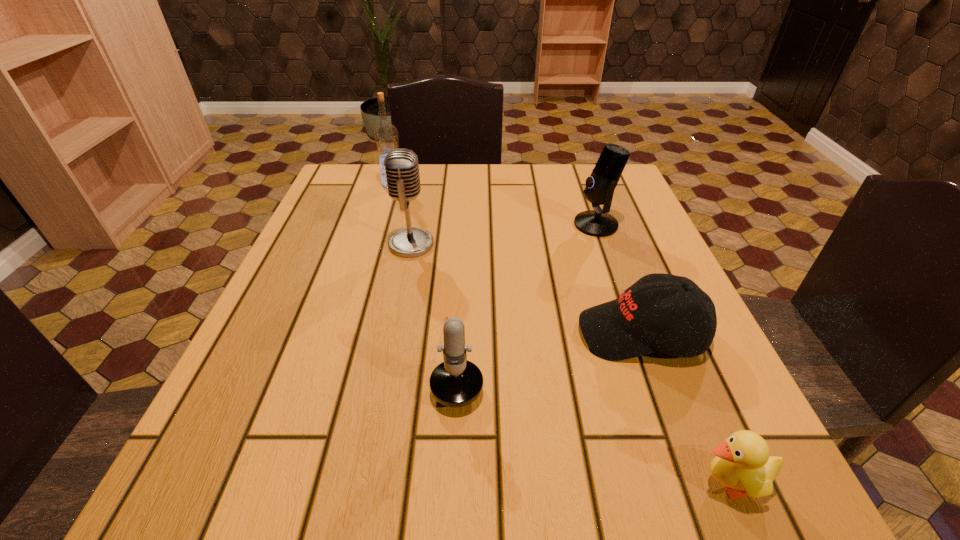
What are the coordinates of `vodka at the far edge` in the screenshot? It's located at (386, 138).

Find the location of `microphone that is at the far edge`. microphone that is at the far edge is located at coordinates (600, 186).

The image size is (960, 540). Identify the location of object that is at the near edge. (743, 464).

Locate an element on the screen. object that is at the left edge is located at coordinates (386, 138).

The image size is (960, 540). I want to click on microphone that is at the right edge, so click(600, 186).

Identify the location of baseball cap located in the right edge section of the desktop. [x=630, y=326].

The width and height of the screenshot is (960, 540). I want to click on duckling that is at the right edge, so click(743, 464).

Identify the location of object located in the far left corner section of the desktop. The width and height of the screenshot is (960, 540). (386, 138).

Image resolution: width=960 pixels, height=540 pixels. I want to click on object present at the far right corner, so click(x=600, y=186).

Find the location of a particular element. The width and height of the screenshot is (960, 540). object present at the near right corner is located at coordinates (743, 464).